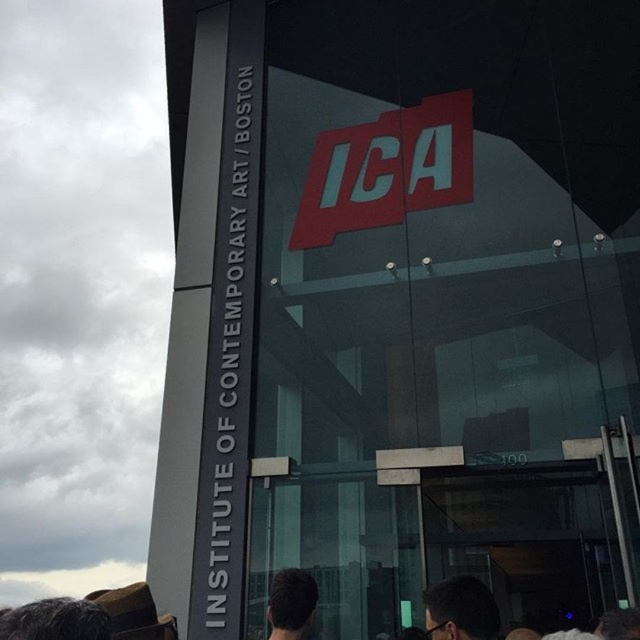
Between dark brown hair at lower right and dark brown hair at lower center, which one has less height?

dark brown hair at lower right

Who is positioned more to the right, dark brown hair at lower right or dark brown hair at lower center?

dark brown hair at lower right

Does point (460, 637) come behind point (269, 593)?

No, it is in front of (269, 593).

This screenshot has height=640, width=640. Identify the location of dark brown hair at lower right. click(460, 609).